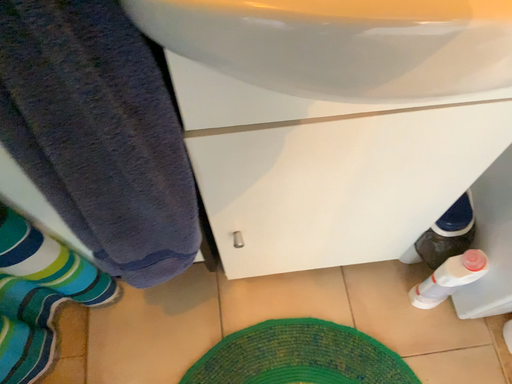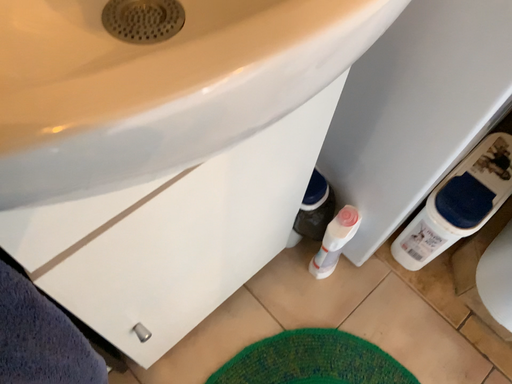
Question: How did the camera likely rotate when shooting the video?

Choices:
 (A) rotated upward
 (B) rotated downward

Answer: (A)